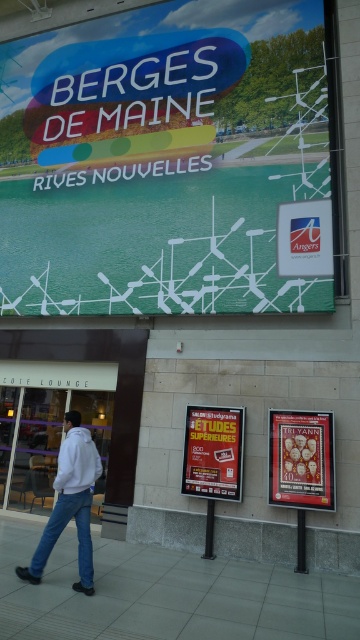
You are standing in front of the building and want to place a new sign at the same 2D location as the white fleece jacket at lower left. What coordinates should you use?

You should use the coordinates point [70,502] to place the new sign at the same 2D location as the white fleece jacket at lower left.

You are standing in front of the building and want to locate the metallic gold poster at center. Where should you look?

You should look at point (300, 460) to find the metallic gold poster at center.